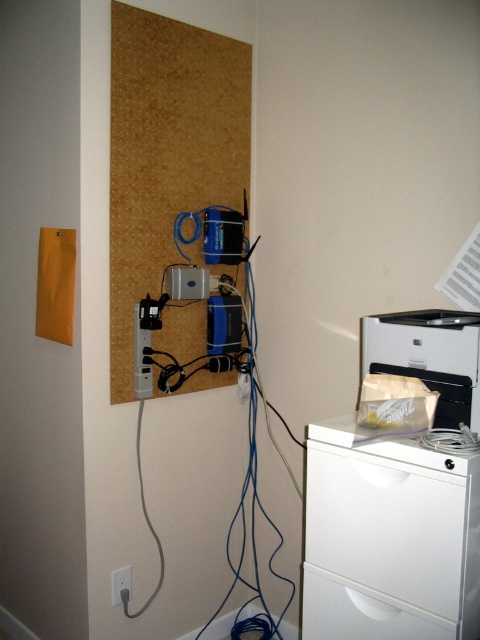
Which is in front, point (312, 538) or point (345, 630)?

Point (345, 630) is more forward.

Between point (451, 508) and point (385, 600), which one is positioned in front?

Point (451, 508) is in front.

I want to click on white plastic file cabinet at lower right, so click(x=387, y=538).

Does white plastic file cabinet at lower right lie behind white matte printer at lower right?

No, white plastic file cabinet at lower right is closer to the viewer.

Does white plastic file cabinet at lower right have a greater height compared to white matte printer at lower right?

Indeed, white plastic file cabinet at lower right has a greater height compared to white matte printer at lower right.

Who is more distant from viewer, [325,516] or [424,344]?

Point [325,516]

The width and height of the screenshot is (480, 640). What are the coordinates of `white plastic file cabinet at lower right` in the screenshot? It's located at (387, 538).

Does white matte printer at lower right appear on the left side of white plastic electric outlet at lower left?

No, white matte printer at lower right is not to the left of white plastic electric outlet at lower left.

Who is taller, white matte printer at lower right or white plastic electric outlet at lower left?

white matte printer at lower right is taller.

Which is in front, point (404, 371) or point (115, 602)?

Point (404, 371)

Where is `white matte printer at lower right`? white matte printer at lower right is located at coordinates (429, 356).